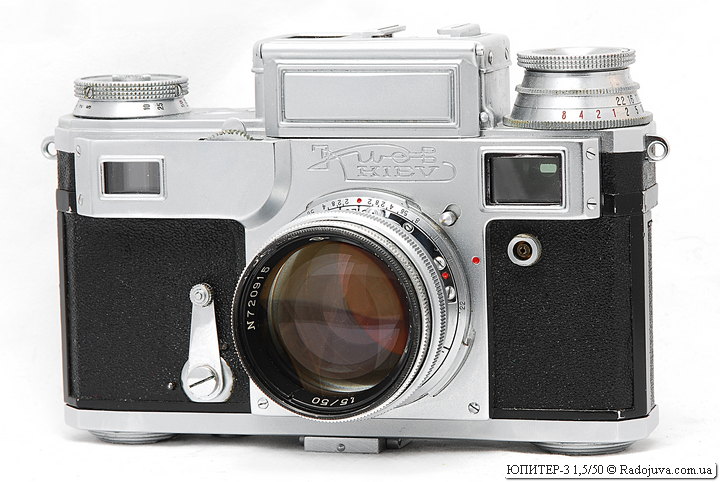
This screenshot has width=720, height=482. I want to click on hook, so click(x=659, y=151).